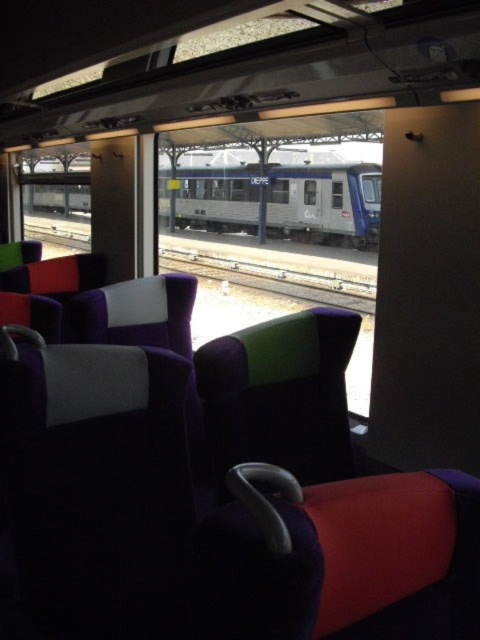
Which is above, purple fabric seat at center or velvet green armrest at center?

velvet green armrest at center is above.

Does purple fabric seat at center appear on the left side of velvet green armrest at center?

Correct, you'll find purple fabric seat at center to the left of velvet green armrest at center.

Identify the location of purple fabric seat at center. (211, 520).

Between purple fabric seat at center and metal train track at center, which one is positioned higher?

metal train track at center

Can you confirm if purple fabric seat at center is positioned above metal train track at center?

No.

Is point (154, 564) in front of point (269, 243)?

Yes, it is.

Identify the location of purple fabric seat at center. This screenshot has height=640, width=480. (211, 520).

From the picture: Who is positioned more to the left, velvet green armrest at center or silver metallic train at center?

Positioned to the left is silver metallic train at center.

Is velvet green armrest at center to the right of silver metallic train at center from the viewer's perspective?

Indeed, velvet green armrest at center is positioned on the right side of silver metallic train at center.

Who is more forward, (254,330) or (315,186)?

Point (254,330)

Identify the location of velvet green armrest at center. The width and height of the screenshot is (480, 640). (280, 394).